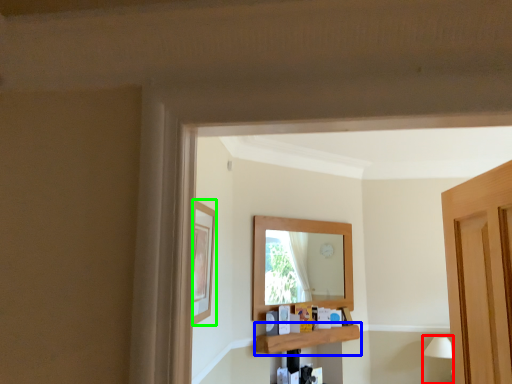
Question: Which object is positioned farthest from lamp (highlighted by a red box)? Select from shelf (highlighted by a blue box) and picture frame (highlighted by a green box).

Choices:
 (A) shelf
 (B) picture frame

Answer: (B)